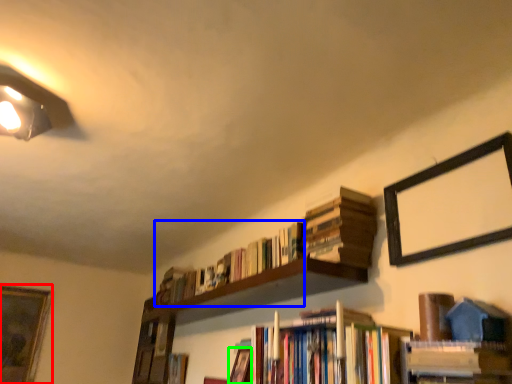
Question: Estimate the real-world distances between objects in this image. Which object is farther from picture frame (highlighted by a red box), book (highlighted by a blue box) or book (highlighted by a green box)?

Choices:
 (A) book
 (B) book

Answer: (B)